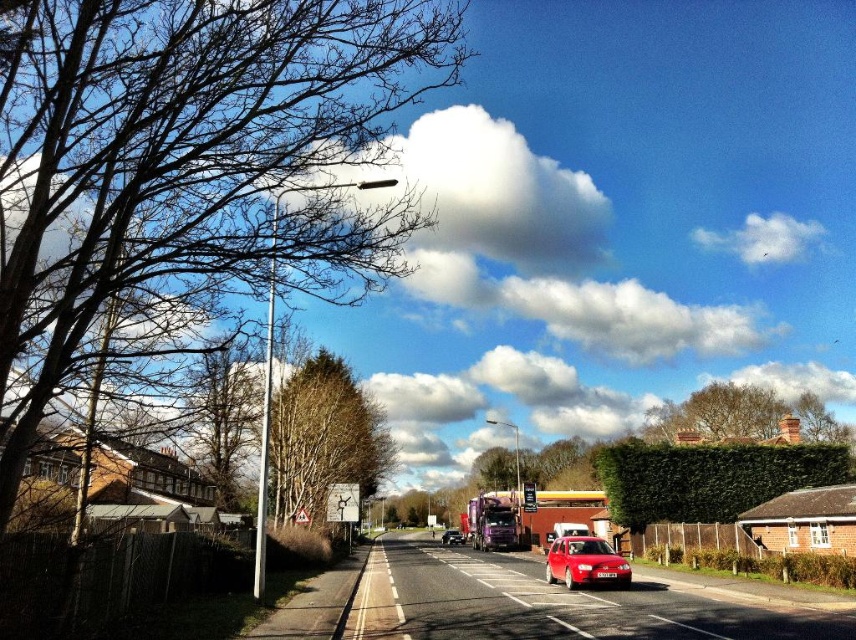
You are a delivery driver trying to navigate through the suburban street. You see the bare branches at left and the metallic purple truck at center. Which object is taller and could potentially block your view ahead?

The bare branches at left is taller than the metallic purple truck at center, so it could potentially block your view ahead.

Consider the image. You are a photographer trying to capture the entire scene of the bare branches at left and the shiny red car at center in one shot. Based on their sizes in the image, which object would require you to adjust your camera position to include both in the frame more easily?

The bare branches at left has a larger size compared to the shiny red car at center, so adjusting the camera position to include both would be easier by focusing on the smaller shiny red car at center first and then framing the larger bare branches at left accordingly.